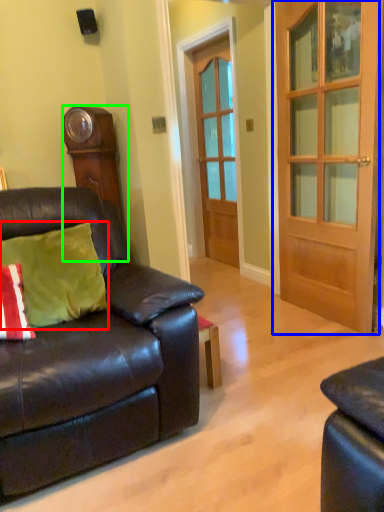
Question: Which is farther away from pillow (highlighted by a red box)? door (highlighted by a blue box) or cabinetry (highlighted by a green box)?

Choices:
 (A) door
 (B) cabinetry

Answer: (A)